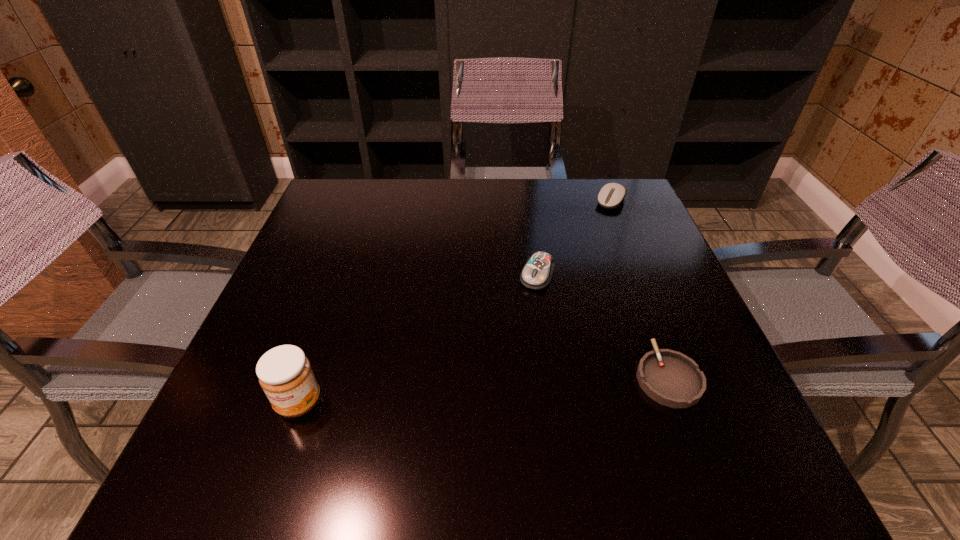
Locate an element on the screen. Image resolution: width=960 pixels, height=540 pixels. the tallest object is located at coordinates (284, 372).

Find the location of a particular element. Image resolution: width=960 pixels, height=540 pixels. jam is located at coordinates (284, 372).

Find the location of `the shortest object`. the shortest object is located at coordinates (672, 379).

You are a GUI agent. You are given a task and a screenshot of the screen. Output one action in this format:
    pyautogui.click(x=<x>, y=<y>)
    Task: Click on the farthest object
    This screenshot has width=960, height=540.
    Given the screenshot: What is the action you would take?
    pyautogui.click(x=611, y=195)

Where is `the right computer mouse`? The width and height of the screenshot is (960, 540). the right computer mouse is located at coordinates (611, 195).

You are a GUI agent. You are given a task and a screenshot of the screen. Output one action in this format:
    pyautogui.click(x=<x>, y=<y>)
    Task: Click on the third nearest object
    
    Given the screenshot: What is the action you would take?
    pyautogui.click(x=537, y=273)

Find the location of a particular element. the second object from left to right is located at coordinates (537, 273).

Locate an element on the screen. This screenshot has height=540, width=960. free space located 0.050m on the right of the ashtray is located at coordinates (726, 376).

This screenshot has width=960, height=540. Find the location of `free location located on the wheel side of the right computer mouse`. free location located on the wheel side of the right computer mouse is located at coordinates (596, 222).

Image resolution: width=960 pixels, height=540 pixels. Identify the location of vacant space located on the wheel side of the right computer mouse. (575, 250).